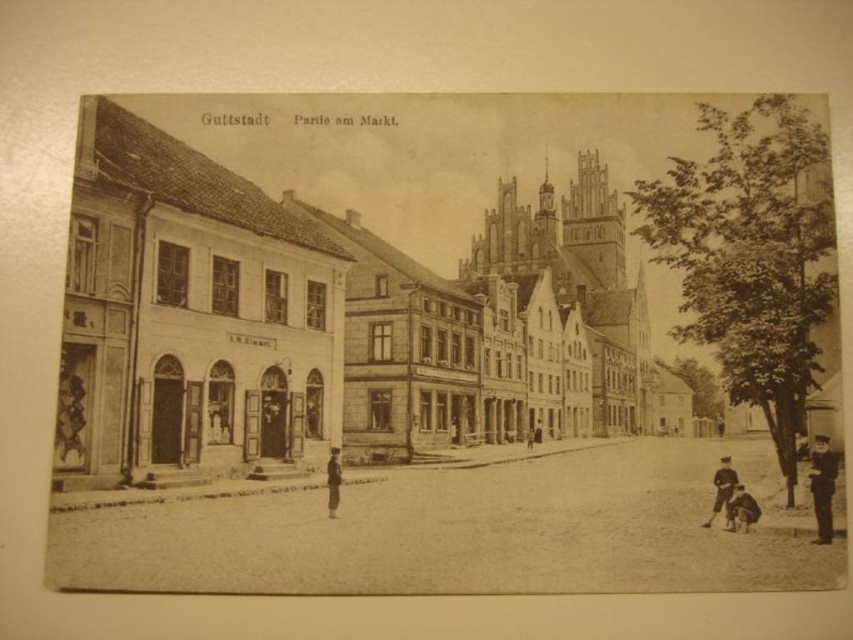
You are observing the vintage postcard of Guttstadt Partie am Markt. There is a uniformed man at right and a dark brown uniform at center. Which of these two has a larger size in the image?

The uniformed man at right has a greater height compared to the dark brown uniform at center, so the uniformed man at right is larger in size.

You are a tourist visiting the market square in Guttstadt. You notice a point marked at coordinates (822, 486) on the image. Based on the scene description, what object or feature does this point correspond to?

The point at coordinates (822, 486) corresponds to the uniformed man at right, as indicated in the objects description.

You are a tourist in Guttstadt Market and want to find the uniformed man at right. You see the dark brown leather jacket at lower right in the scene. Which direction should you move to locate him?

The uniformed man at right is to the right of the dark brown leather jacket at lower right, so you should move to the right of the dark brown leather jacket at lower right to locate him.